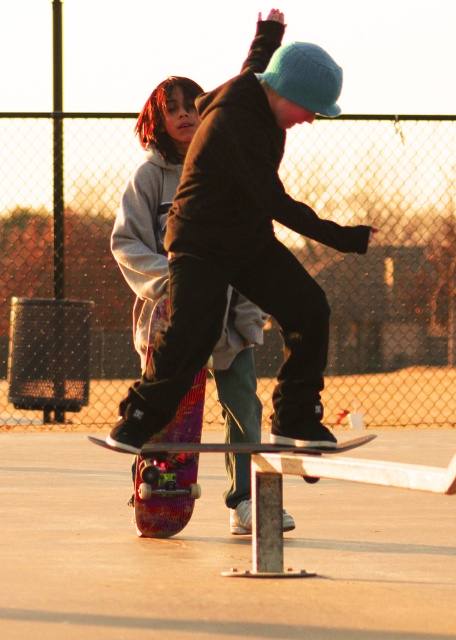
Which of these two, multicolored wooden skateboard at center or multicolored glossy skateboard at center, stands shorter?

With less height is multicolored glossy skateboard at center.

Is point (279, 32) more distant than point (149, 492)?

No, it is in front of (149, 492).

Where is `multicolored wooden skateboard at center`? The height and width of the screenshot is (640, 456). multicolored wooden skateboard at center is located at coordinates (245, 241).